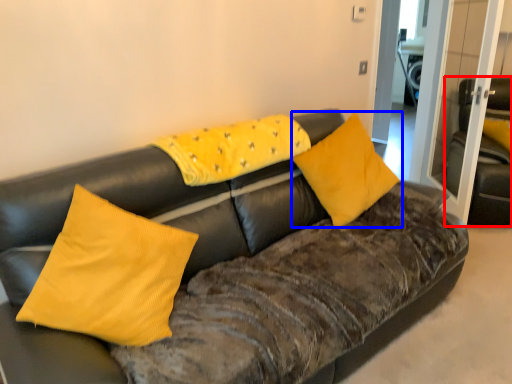
Question: Among these objects, which one is farthest to the camera, armchair (highlighted by a red box) or pillow (highlighted by a blue box)?

Choices:
 (A) armchair
 (B) pillow

Answer: (A)